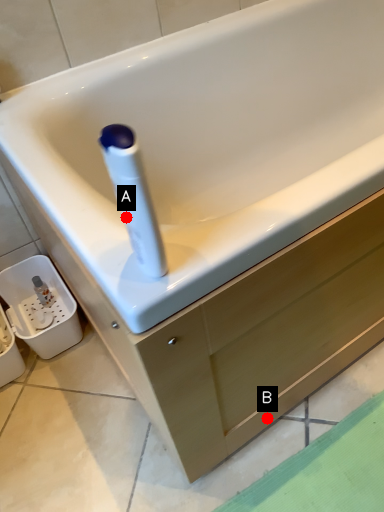
Question: Two points are circled on the image, labeled by A and B beside each circle. Which point appears farthest from the camera in this image?

Choices:
 (A) A is further
 (B) B is further

Answer: (B)